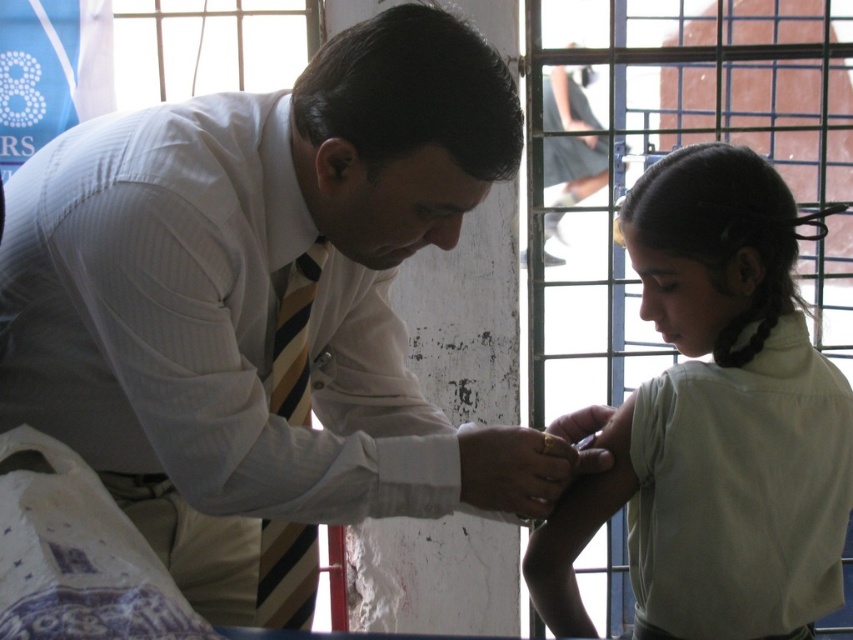
Question: Which of the following is the farthest from the observer?

Choices:
 (A) (309, 548)
 (B) (833, 378)

Answer: (A)

Question: Among these points, which one is nearest to the camera?

Choices:
 (A) (550, 465)
 (B) (645, 518)
 (C) (279, 404)

Answer: (A)

Question: Does white striped shirt at center appear on the left side of gold ring at upper center?

Choices:
 (A) no
 (B) yes

Answer: (B)

Question: Is light beige shirt at right above gold ring at upper center?

Choices:
 (A) no
 (B) yes

Answer: (B)

Question: Can you confirm if striped fabric tie at left is smaller than gold ring at upper center?

Choices:
 (A) yes
 (B) no

Answer: (B)

Question: Estimate the real-world distances between objects in this image. Which object is farther from the striped fabric tie at left?

Choices:
 (A) light beige shirt at right
 (B) gold ring at upper center

Answer: (A)